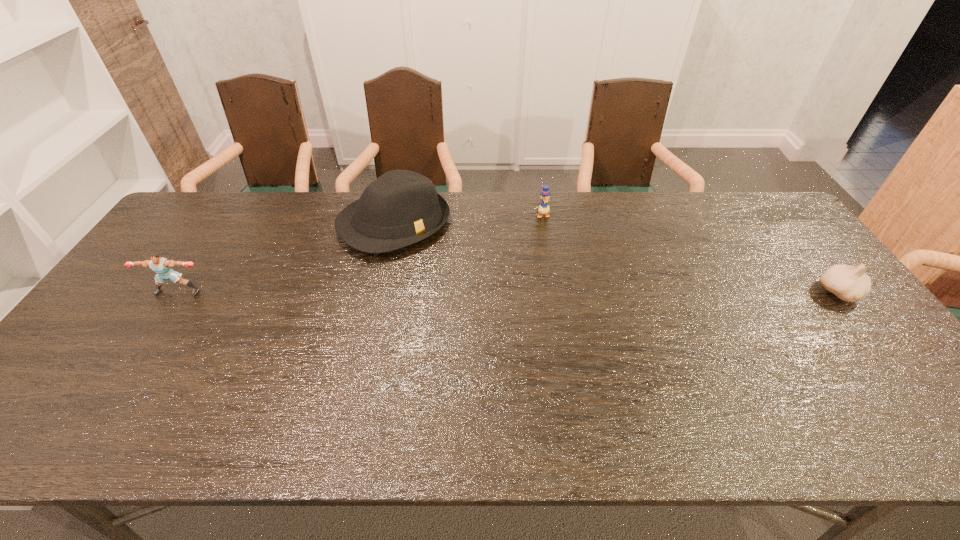
This screenshot has height=540, width=960. Identify the location of puncher. (162, 266).

What are the coordinates of `the rightmost object` in the screenshot? It's located at (849, 283).

Locate an element on the screen. duckling is located at coordinates (544, 208).

Locate an element on the screen. The image size is (960, 540). the second object from left to right is located at coordinates (401, 207).

Locate an element on the screen. The width and height of the screenshot is (960, 540). vacant space situated on the front-facing side of the leftmost object is located at coordinates (146, 340).

Locate an element on the screen. The image size is (960, 540). vacant area situated 0.330m on the left of the garlic is located at coordinates (701, 293).

This screenshot has height=540, width=960. In order to click on vacant area located on the face of the duckling, where the monocle is placed in this screenshot , I will do `click(554, 246)`.

Identify the location of vacant area situated on the face of the duckling, where the monocle is placed. Image resolution: width=960 pixels, height=540 pixels. (551, 238).

Find the location of a particular element. The image size is (960, 540). free space located on the face of the duckling, where the monocle is placed is located at coordinates (564, 275).

Find the location of `vacant position located on the front-facing side of the second object from left to right`. vacant position located on the front-facing side of the second object from left to right is located at coordinates (442, 266).